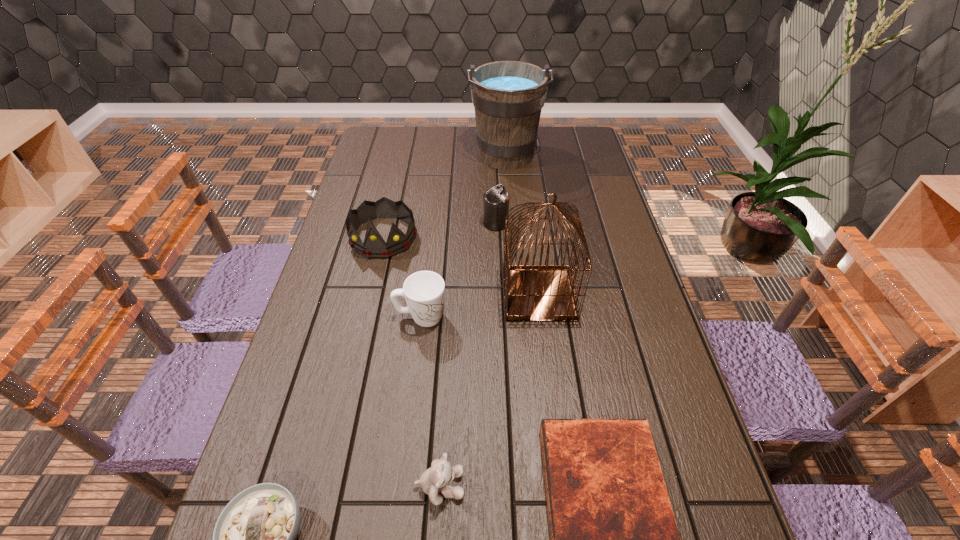
You are a GUI agent. You are given a task and a screenshot of the screen. Output one action in this format:
    pyautogui.click(x=<x>, y=<y>)
    Task: Click on the farthest object
    The height and width of the screenshot is (540, 960).
    Given the screenshot: What is the action you would take?
    pyautogui.click(x=508, y=96)

The width and height of the screenshot is (960, 540). What are the coordinates of `birdcage` in the screenshot? It's located at (532, 292).

In order to click on tiara in this screenshot , I will do pos(374,246).

The width and height of the screenshot is (960, 540). Find the location of `can`. can is located at coordinates (496, 200).

Locate an element on the screen. Image resolution: width=960 pixels, height=540 pixels. mug is located at coordinates (424, 291).

The image size is (960, 540). Identify the location of teddy bear. (434, 480).

This screenshot has height=540, width=960. In order to click on vacant space located with a handle on the side of the farthest object in this screenshot , I will do `click(512, 231)`.

Locate an element on the screen. This screenshot has height=540, width=960. vacant area situated on the front of the birdcage is located at coordinates (547, 358).

You are a GUI agent. You are given a task and a screenshot of the screen. Output one action in this format:
    pyautogui.click(x=<x>, y=<y>)
    Task: Click on the free space located 0.180m at the front of the tiara with jewels
    The width and height of the screenshot is (960, 540).
    Given the screenshot: What is the action you would take?
    pyautogui.click(x=367, y=307)

You are a GUI agent. You are given a task and a screenshot of the screen. Output one action in this format:
    pyautogui.click(x=<x>, y=<y>)
    Task: Click on the vacant space located on the front of the can
    This screenshot has width=960, height=540.
    Given the screenshot: What is the action you would take?
    pos(499,312)